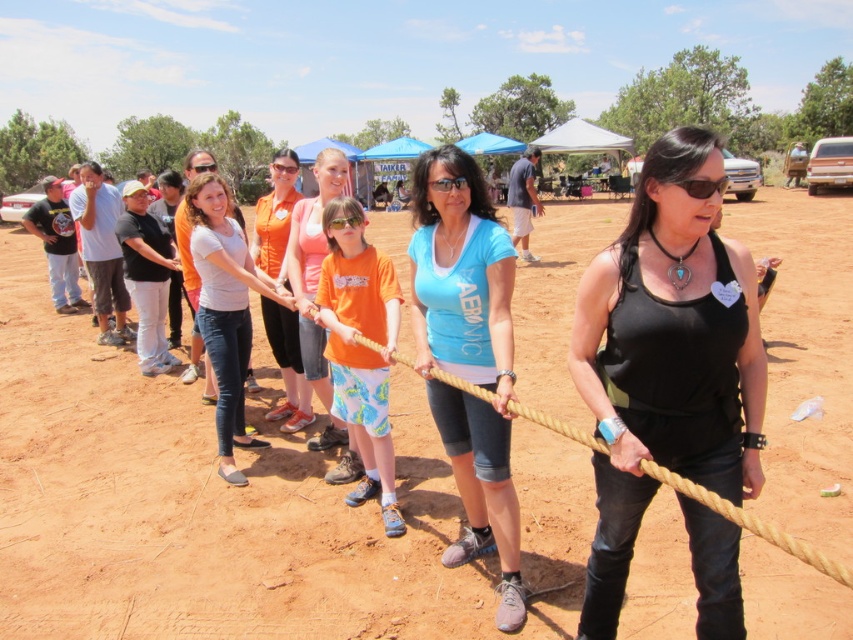
You are a photographer trying to capture a photo of the tug of war scene. You want to ensure both the white cotton shirt at center and orange cotton shirt at center are clearly visible in your shot. Considering their heights, which one might you need to adjust your camera angle to focus on?

The white cotton shirt at center is shorter than the orange cotton shirt at center, so you might need to lower your camera angle to ensure the white cotton shirt at center is visible above the rope or other participants.

You are standing at the origin point of the image and want to locate the white cotton shirt at center. Which direction should you look to find it?

The white cotton shirt at center is located at point 0.483 on the x axis and 0.265 on the y axis. Since the x coordinate is close to 0.5, it is near the center horizontally. The y coordinate is 0.265, which is closer to the bottom of the image. Therefore, you should look slightly to the right and downward from the center to locate it.

You are organizing a tug of war event and need to ensure participants are evenly spaced. Looking at the black leather tank top at center and the white cotton shirt at center, which participant takes up more space in the line?

The white cotton shirt at center takes up more space than the black leather tank top at center.